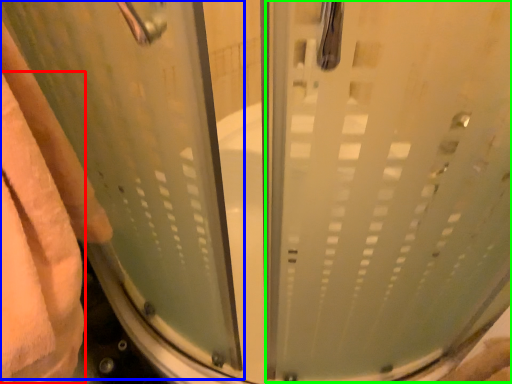
Question: Which object is positioned farthest from bath towel (highlighted by a red box)? Select from screen door (highlighted by a blue box) and screen door (highlighted by a green box).

Choices:
 (A) screen door
 (B) screen door

Answer: (B)